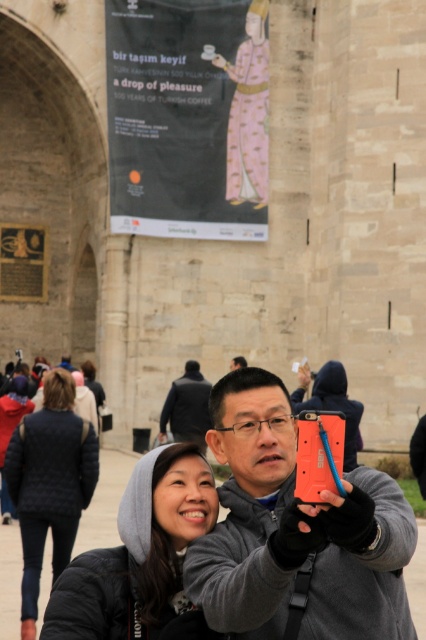
Is orange matte phone at center to the left of gray hoodie at center from the viewer's perspective?

→ Incorrect, orange matte phone at center is not on the left side of gray hoodie at center.

Between orange matte phone at center and gray hoodie at center, which one is positioned higher?

Positioned higher is orange matte phone at center.

Image resolution: width=426 pixels, height=640 pixels. I want to click on orange matte phone at center, so click(x=294, y=531).

Can you confirm if orange matte phone at center is positioned below matte black poster at upper center?

Correct, orange matte phone at center is located below matte black poster at upper center.

Is point (273, 573) positioned after point (109, 193)?

That is False.

Describe the element at coordinates (294, 531) in the screenshot. I see `orange matte phone at center` at that location.

The height and width of the screenshot is (640, 426). Identify the location of orange matte phone at center. (294, 531).

Who is more forward, (160, 168) or (20, 460)?

Point (20, 460)

Is matte black poster at upper center taller than quilted black jacket at lower left?

Indeed, matte black poster at upper center has a greater height compared to quilted black jacket at lower left.

Between point (261, 68) and point (77, 419), which one is positioned in front?

Point (77, 419)

Where is `matte black poster at upper center`? Image resolution: width=426 pixels, height=640 pixels. matte black poster at upper center is located at coordinates (187, 116).